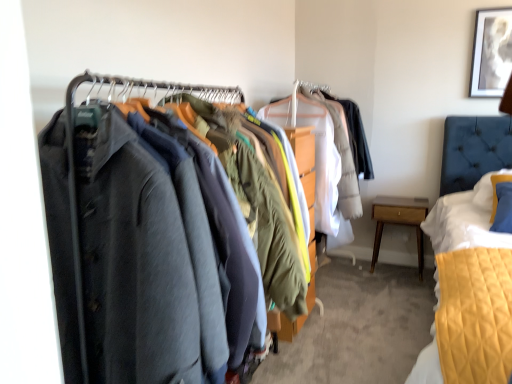
Question: Is matte black coat at left closer to camera compared to white paper at upper right?

Choices:
 (A) yes
 (B) no

Answer: (A)

Question: From the image's perspective, is matte black coat at left below white paper at upper right?

Choices:
 (A) no
 (B) yes

Answer: (B)

Question: Is matte black coat at left wider than white paper at upper right?

Choices:
 (A) yes
 (B) no

Answer: (A)

Question: Is matte black coat at left positioned with its back to white paper at upper right?

Choices:
 (A) yes
 (B) no

Answer: (B)

Question: From the image's perspective, is matte black coat at left located above white paper at upper right?

Choices:
 (A) no
 (B) yes

Answer: (A)

Question: Is white paper at upper right inside or outside of matte black coat at left?

Choices:
 (A) outside
 (B) inside

Answer: (A)

Question: In terms of size, does white paper at upper right appear bigger or smaller than matte black coat at left?

Choices:
 (A) small
 (B) big

Answer: (A)

Question: In the image, is white paper at upper right on the left side or the right side of matte black coat at left?

Choices:
 (A) right
 (B) left

Answer: (A)

Question: From the image's perspective, is white paper at upper right above or below matte black coat at left?

Choices:
 (A) below
 (B) above

Answer: (B)

Question: Is matte black coat at left taller or shorter than light wood/finely crafted nightstand at lower right?

Choices:
 (A) tall
 (B) short

Answer: (A)

Question: From the image's perspective, is matte black coat at left above or below light wood/finely crafted nightstand at lower right?

Choices:
 (A) below
 (B) above

Answer: (B)

Question: From a real-world perspective, is matte black coat at left positioned above or below light wood/finely crafted nightstand at lower right?

Choices:
 (A) below
 (B) above

Answer: (B)

Question: Would you say matte black coat at left is to the left or to the right of light wood/finely crafted nightstand at lower right in the picture?

Choices:
 (A) left
 (B) right

Answer: (A)

Question: Is white paper at upper right spatially inside light wood/finely crafted nightstand at lower right, or outside of it?

Choices:
 (A) inside
 (B) outside

Answer: (B)

Question: Considering their positions, is white paper at upper right located in front of or behind light wood/finely crafted nightstand at lower right?

Choices:
 (A) behind
 (B) front

Answer: (B)